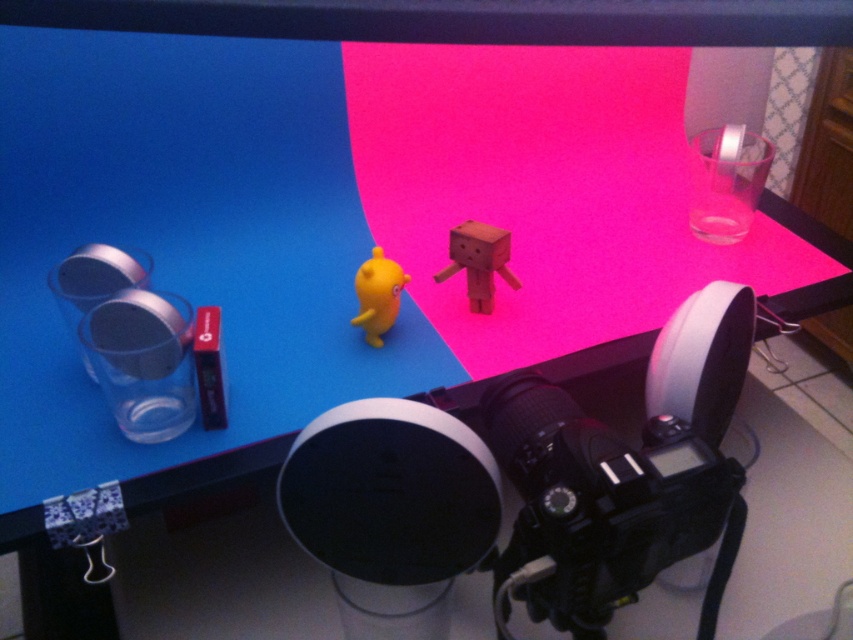
Is the position of wooden block at center less distant than that of matte yellow rubber duck at center?

No, wooden block at center is further to the viewer.

Which is below, wooden block at center or matte yellow rubber duck at center?

matte yellow rubber duck at center is lower down.

At what (x,y) coordinates should I click in order to perform the action: click on wooden block at center. Please return your answer as a coordinate pair (x, y). The height and width of the screenshot is (640, 853). Looking at the image, I should click on (479, 260).

Locate an element on the screen. This screenshot has width=853, height=640. wooden block at center is located at coordinates (479, 260).

Does black plastic video camera at center have a larger size compared to wooden block at center?

Yes, black plastic video camera at center is bigger than wooden block at center.

What are the coordinates of `black plastic video camera at center` in the screenshot? It's located at (518, 492).

Is point (648, 577) farther from viewer compared to point (490, 308)?

No, it is in front of (490, 308).

You are a GUI agent. You are given a task and a screenshot of the screen. Output one action in this format:
    pyautogui.click(x=<x>, y=<y>)
    Task: Click on the black plastic video camera at center
    The height and width of the screenshot is (640, 853).
    Given the screenshot: What is the action you would take?
    pyautogui.click(x=518, y=492)

Does black plastic video camera at center have a lesser height compared to matte yellow rubber duck at center?

No, black plastic video camera at center is not shorter than matte yellow rubber duck at center.

Between point (601, 596) and point (374, 262), which one is positioned behind?

The point (374, 262) is behind.

Where is `black plastic video camera at center`? The width and height of the screenshot is (853, 640). black plastic video camera at center is located at coordinates (518, 492).